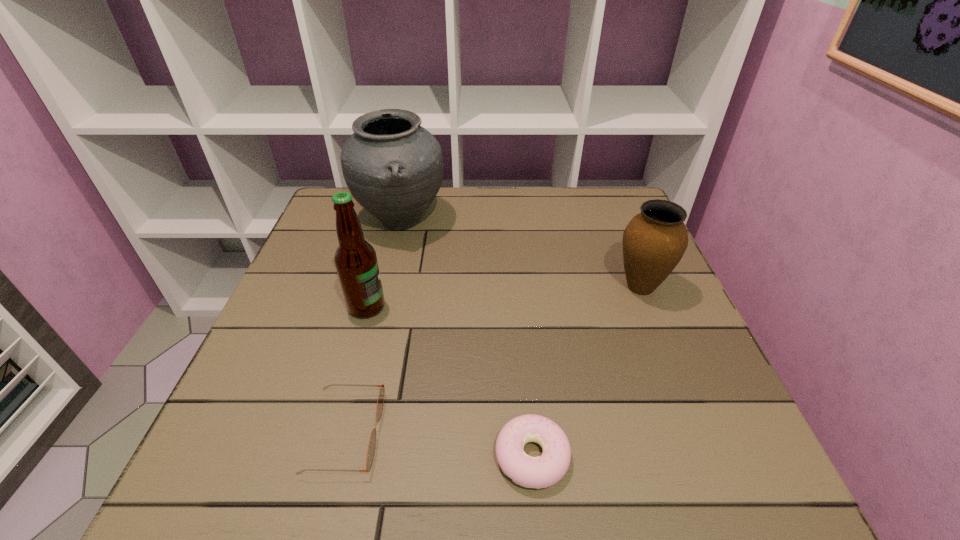
Find the location of a particular element. vacant area situated on the face of the sunglasses is located at coordinates (414, 433).

Locate an element on the screen. The width and height of the screenshot is (960, 540). free space located 0.340m on the left of the second object from right to left is located at coordinates (284, 456).

What are the coordinates of `object at the far edge` in the screenshot? It's located at (393, 167).

The image size is (960, 540). I want to click on sunglasses that is at the near edge, so click(372, 442).

The width and height of the screenshot is (960, 540). Find the location of `doughnut at the near edge`. doughnut at the near edge is located at coordinates pos(543,471).

This screenshot has height=540, width=960. In order to click on urn that is positioned at the left edge in this screenshot , I will do `click(393, 167)`.

The width and height of the screenshot is (960, 540). Identify the location of beer bottle situated at the left edge. (355, 259).

The image size is (960, 540). Find the location of `sunglasses positioned at the left edge`. sunglasses positioned at the left edge is located at coordinates (372, 442).

This screenshot has height=540, width=960. I want to click on object situated at the right edge, so click(x=654, y=241).

I want to click on object that is at the far left corner, so click(x=393, y=167).